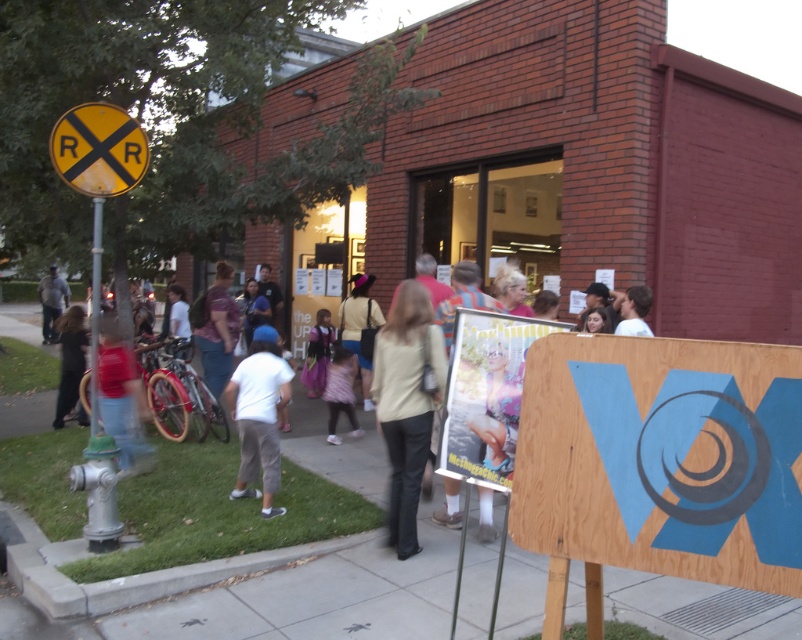
Question: Is wooden signboard at center-right smaller than denim pants at left?

Choices:
 (A) yes
 (B) no

Answer: (A)

Question: Which object is the farthest from the light pink fabric dress at center?

Choices:
 (A) beige fabric pants at center
 (B) white cotton shirt at center

Answer: (A)

Question: Which point is farther to the camera?

Choices:
 (A) white cotton shirt at center
 (B) denim pants at left

Answer: (B)

Question: Can you confirm if white cotton shirt at center is wider than yellowmaterial/texturerr sign at left?

Choices:
 (A) no
 (B) yes

Answer: (A)

Question: Is matte red shirt at center below dark gray pants at lower left?

Choices:
 (A) yes
 (B) no

Answer: (A)

Question: Which point is farther to the camera?

Choices:
 (A) (55, 337)
 (B) (71, 321)

Answer: (A)